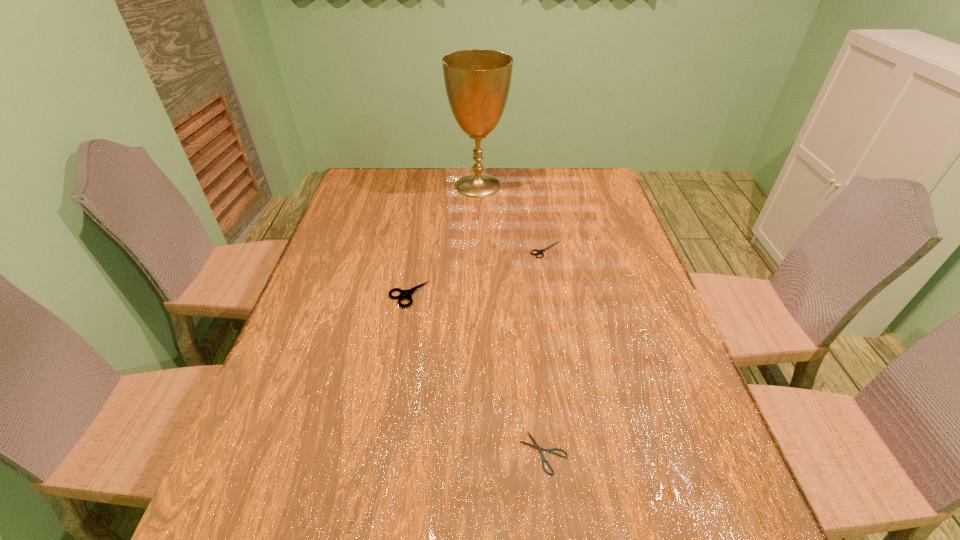
Identify the location of shears that is the nearest to the tallest shears. (539, 252).

Select which shears is the second closest to the nearest shears. Please provide its 2D coordinates. Your answer should be formatted as a tuple, i.e. [(x, y)], where the tuple contains the x and y coordinates of a point satisfying the conditions above.

[(539, 252)]

Locate an element on the screen. free location that satisfies the following two spatial constraints: 1. on the back side of the shortest object; 2. on the right side of the second shortest object is located at coordinates (521, 249).

Image resolution: width=960 pixels, height=540 pixels. What are the coordinates of `vacant space that satisfies the following two spatial constraints: 1. on the back side of the leftmost object; 2. on the left side of the tallest object` in the screenshot? It's located at (427, 186).

This screenshot has width=960, height=540. I want to click on vacant area that satisfies the following two spatial constraints: 1. on the front side of the third nearest object; 2. on the left side of the farthest object, so click(x=478, y=249).

The image size is (960, 540). Identify the location of free point that satisfies the following two spatial constraints: 1. on the back side of the second nearest object; 2. on the left side of the trophy cup. (427, 186).